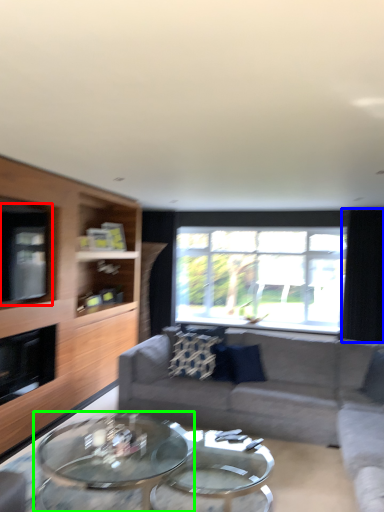
Question: Which is nearer to the window screen (highlighted by a red box)? curtain (highlighted by a blue box) or coffee table (highlighted by a green box).

Choices:
 (A) curtain
 (B) coffee table

Answer: (B)